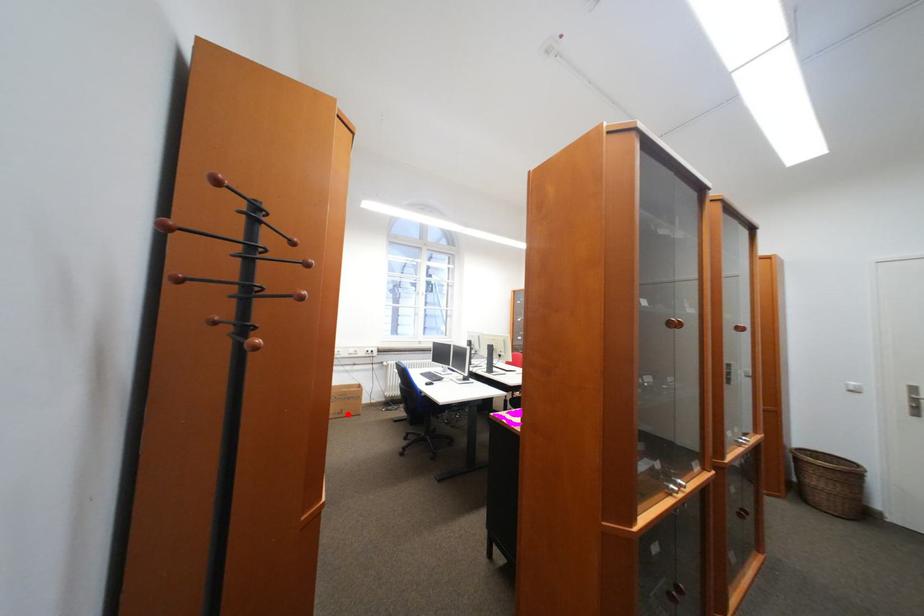
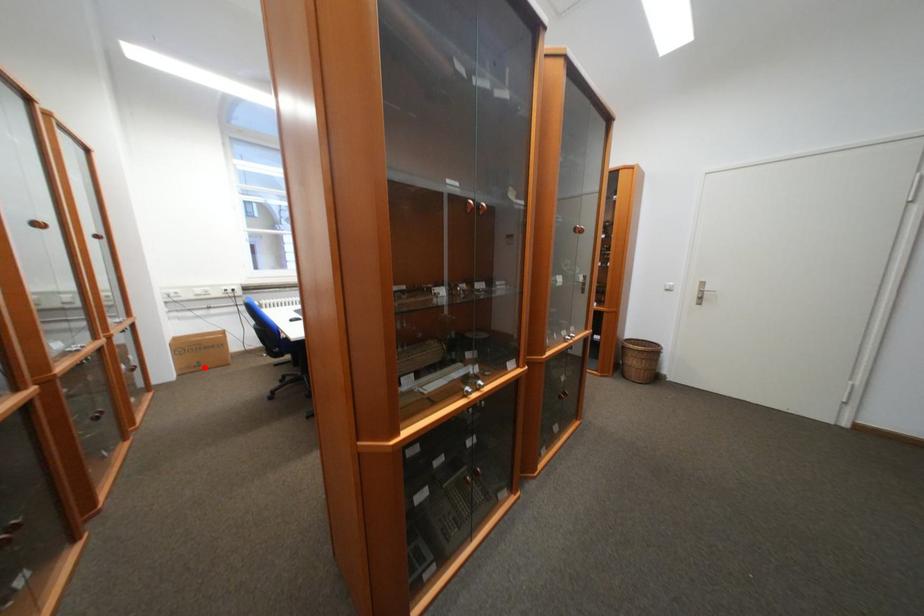
I am providing you with two images of the same scene from different viewpoints. A red point is marked on the first image and another point is marked on the second image. Do the highlighted points in image1 and image2 indicate the same real-world spot?

Yes